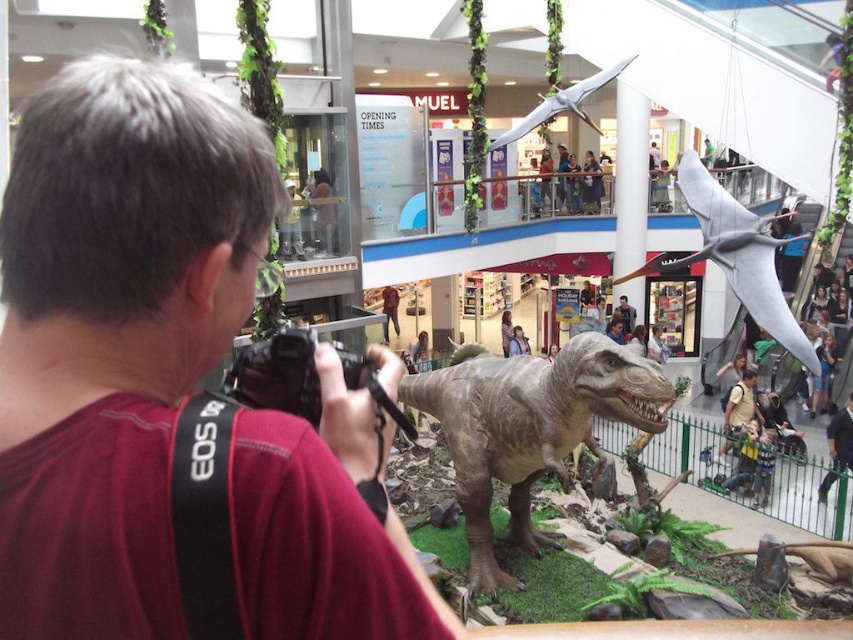
Is point (555, 198) in front of point (582, 120)?

No, it is behind (582, 120).

Can you confirm if light brown leather jacket at upper center is thinner than gray matte pterodactyl at upper center?

Yes, light brown leather jacket at upper center is thinner than gray matte pterodactyl at upper center.

Looking at this image, who is more distant from viewer, (547, 173) or (625, 60)?

The point (547, 173) is behind.

This screenshot has height=640, width=853. I want to click on light brown leather jacket at upper center, so click(567, 188).

Is gray textured dinosaur at center to the right of gray matte pterodactyl at upper center from the viewer's perspective?

Incorrect, gray textured dinosaur at center is not on the right side of gray matte pterodactyl at upper center.

What do you see at coordinates (529, 428) in the screenshot? The height and width of the screenshot is (640, 853). I see `gray textured dinosaur at center` at bounding box center [529, 428].

Does point (486, 372) come in front of point (532, 124)?

Yes, it is.

Find the location of `gray textured dinosaur at center`. gray textured dinosaur at center is located at coordinates (529, 428).

Is maroon fabric shirt at center bigger than light brown leather jacket at upper center?

No, maroon fabric shirt at center is not bigger than light brown leather jacket at upper center.

Can you confirm if maroon fabric shirt at center is positioned above light brown leather jacket at upper center?

Actually, maroon fabric shirt at center is below light brown leather jacket at upper center.

Between point (119, 266) and point (564, 168), which one is positioned behind?

Positioned behind is point (564, 168).

I want to click on maroon fabric shirt at center, so click(171, 392).